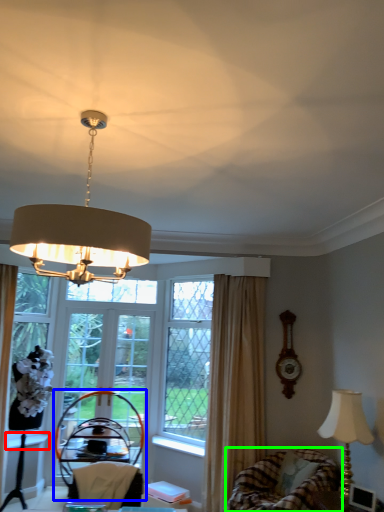
Question: Which is farther away from window sill (highlighted by a red box)? armchair (highlighted by a blue box) or swivel chair (highlighted by a green box)?

Choices:
 (A) armchair
 (B) swivel chair

Answer: (B)